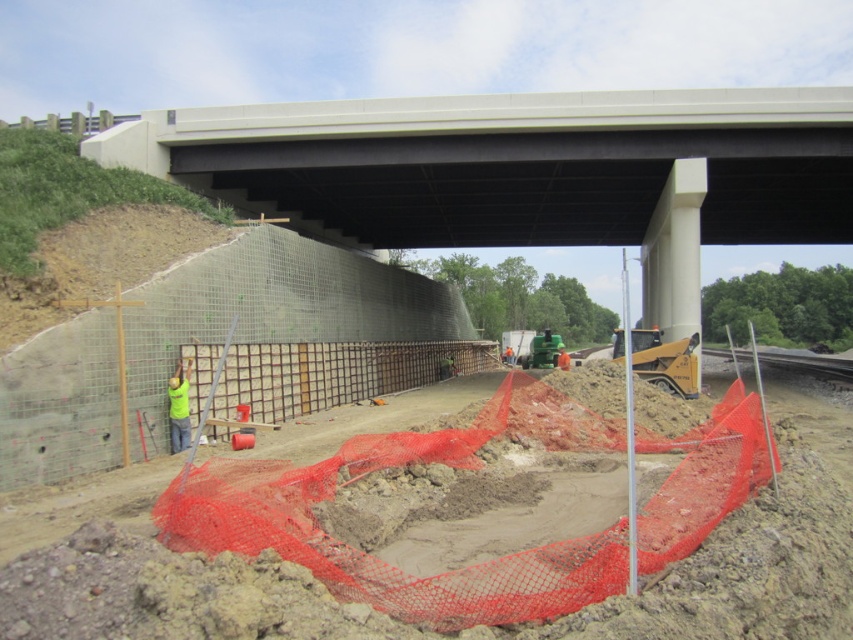
Question: Can you confirm if gray concrete train track at lower right is positioned to the right of yellow reflective vest at center?

Choices:
 (A) no
 (B) yes

Answer: (B)

Question: Does gray concrete train track at lower right appear over yellow reflective vest at center?

Choices:
 (A) yes
 (B) no

Answer: (B)

Question: Does gray concrete train track at lower right lie in front of yellow reflective vest at center?

Choices:
 (A) no
 (B) yes

Answer: (A)